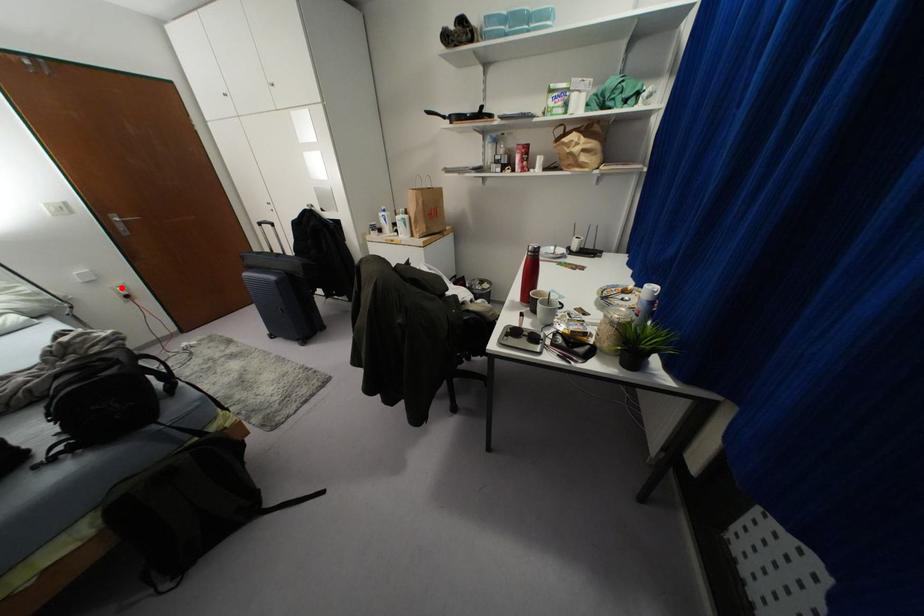
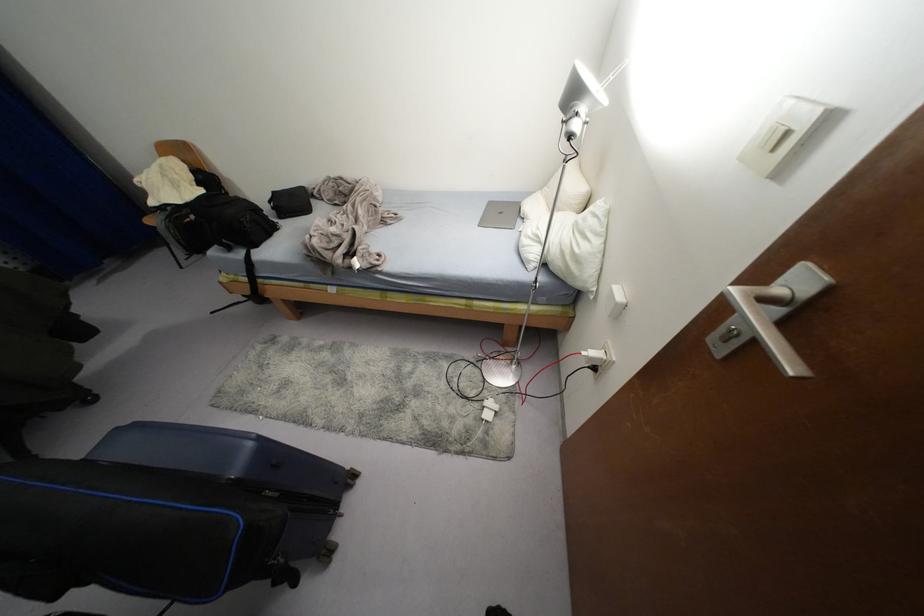
Where in the second image is the point corresponding to the highlighted location from the first image?

(592, 353)